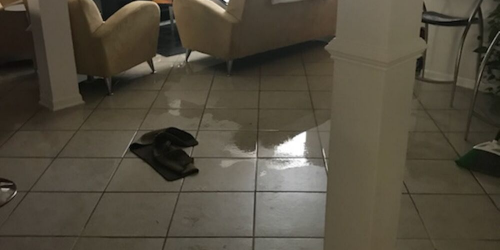
Where is `floor`? The width and height of the screenshot is (500, 250). floor is located at coordinates (227, 140).